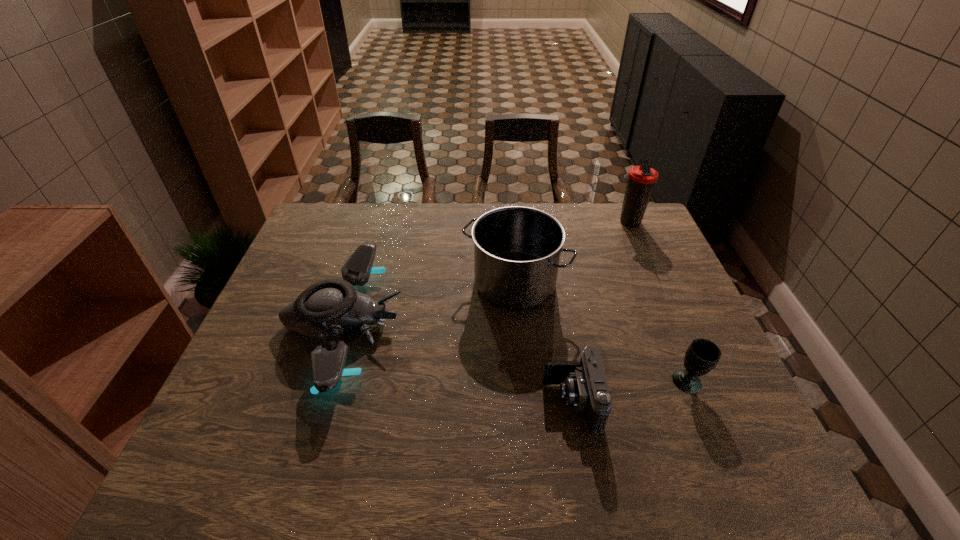
At what (x,y) coordinates should I click in order to perform the action: click on free point between the chalice and the drone. Please return your answer as a coordinate pair (x, y). Looking at the image, I should click on (516, 353).

Locate an element on the screen. This screenshot has height=540, width=960. empty space between the tallest object and the chalice is located at coordinates (659, 302).

I want to click on vacant point located between the farthest object and the second tallest object, so click(x=572, y=252).

Locate an element on the screen. the fourth closest object to the thermos bottle is located at coordinates (328, 307).

Identify which object is the third nearest to the camera. Please provide its 2D coordinates. Your answer should be formatted as a tuple, i.e. [(x, y)], where the tuple contains the x and y coordinates of a point satisfying the conditions above.

[(328, 307)]

Identify the location of vacant space that satisfies the following two spatial constraints: 1. on the back side of the saucepan; 2. on the left side of the farthest object. (510, 222).

Image resolution: width=960 pixels, height=540 pixels. I want to click on free location that satisfies the following two spatial constraints: 1. on the front-facing side of the chalice; 2. on the left side of the leftmost object, so click(325, 382).

Image resolution: width=960 pixels, height=540 pixels. Identify the location of free location that satisfies the following two spatial constraints: 1. on the front-facing side of the chalice; 2. on the left side of the leftmost object. coord(325,382).

Locate an element on the screen. vacant space that satisfies the following two spatial constraints: 1. on the front-facing side of the drone; 2. on the right side of the chalice is located at coordinates (325, 382).

The image size is (960, 540). Find the location of `vacant area that satisfies the following two spatial constraints: 1. on the front-facing side of the leftmost object; 2. on the back side of the chalice`. vacant area that satisfies the following two spatial constraints: 1. on the front-facing side of the leftmost object; 2. on the back side of the chalice is located at coordinates [325, 382].